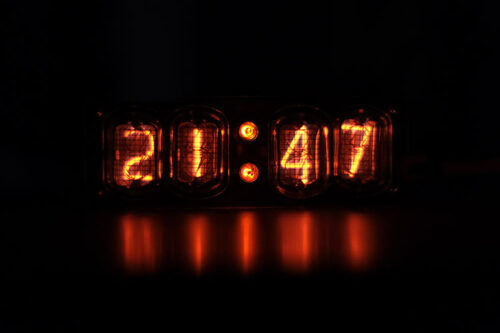
Where is `reflection of led clock readout`? reflection of led clock readout is located at coordinates (147, 235), (306, 233), (359, 240), (246, 238), (199, 237).